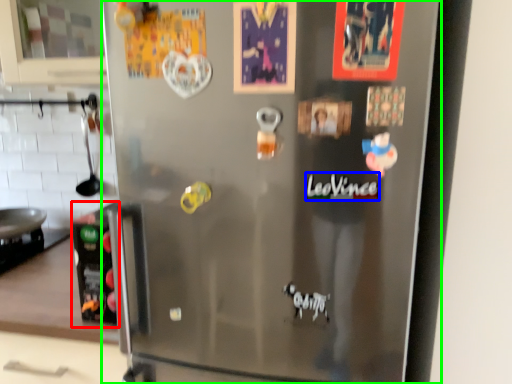
Question: Estimate the real-world distances between objects in this image. Which object is closer to appliance (highlighted by a red box), writing (highlighted by a blue box) or refrigerator (highlighted by a green box)?

Choices:
 (A) writing
 (B) refrigerator

Answer: (A)